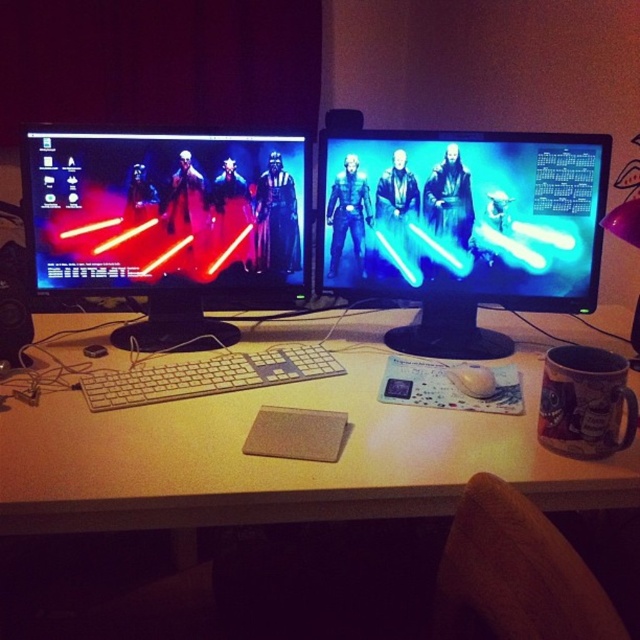
You are organizing a Star Wars themed tech setup. You have a white matte computer desk at center and a blue glossy lightsaber at center. Based on their positions, which object is more to the left?

The white matte computer desk at center is positioned on the left side of the blue glossy lightsaber at center, so it is more to the left.

You are setting up a new monitor stand and need to know which object occupies more horizontal space between the blue glossy lightsaber at center and the white plastic keyboard at center. Which one is wider?

The blue glossy lightsaber at center is wider than the white plastic keyboard at center.